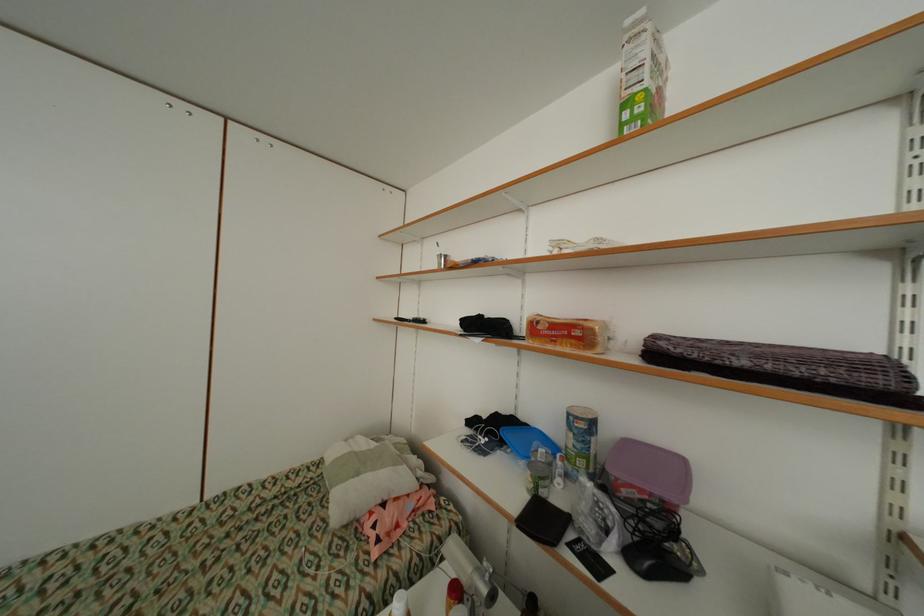
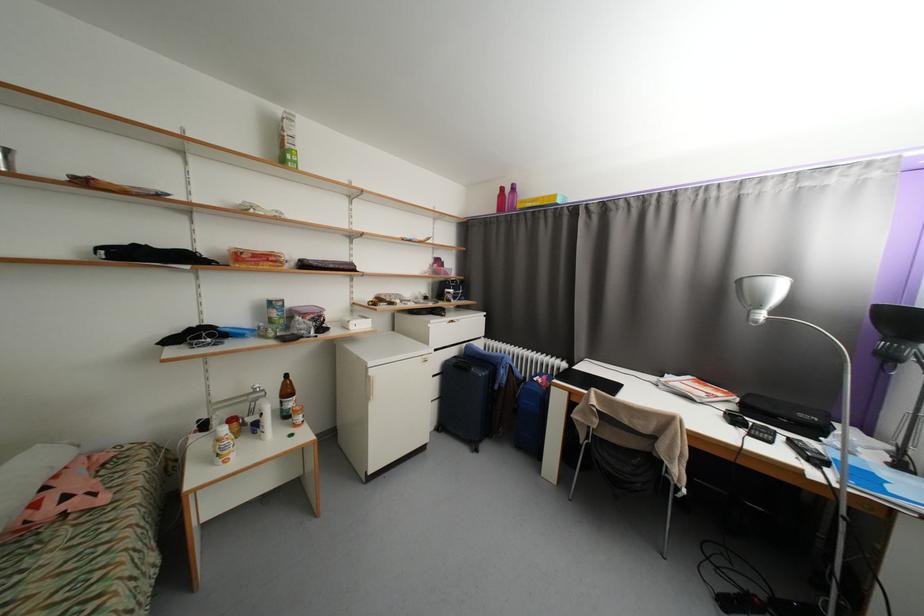
Locate, in the second image, the point that corresponds to the point at 489,578 in the first image.

(261, 392)